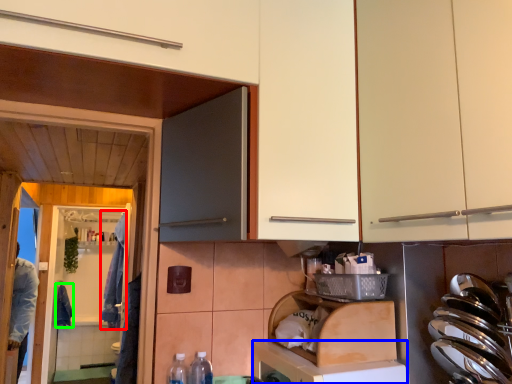
Question: Which object is the farthest from laundry (highlighted by a red box)? Choose among these: dish washer (highlighted by a blue box) or laundry (highlighted by a green box).

Choices:
 (A) dish washer
 (B) laundry

Answer: (A)